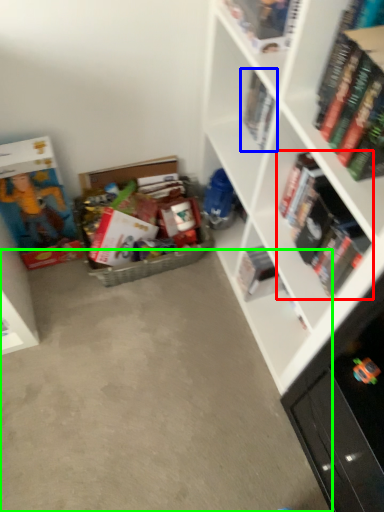
Question: Considering the real-world distances, which object is closest to book (highlighted by a red box)? book (highlighted by a blue box) or concrete (highlighted by a green box).

Choices:
 (A) book
 (B) concrete

Answer: (A)